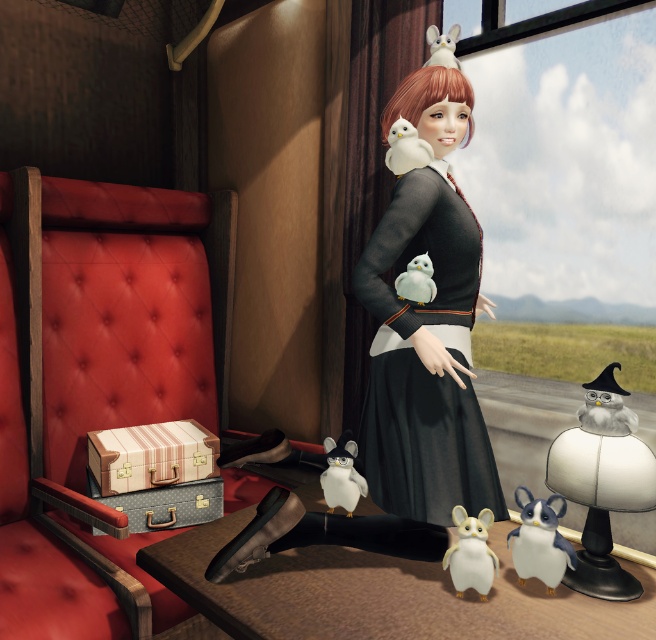
Question: Which point is closer to the camera?

Choices:
 (A) (468, 502)
 (B) (569, 566)
 (C) (256, 577)

Answer: (B)

Question: Which point is farther to the camera?

Choices:
 (A) white plush bird at upper center
 (B) white plush penguin at center

Answer: (B)

Question: Can you confirm if white matte mouse at lower center is positioned to the right of white matte plush toy at center?

Choices:
 (A) no
 (B) yes

Answer: (B)

Question: Is black matte dress at center to the left of white plush bird at upper center from the viewer's perspective?

Choices:
 (A) yes
 (B) no

Answer: (B)

Question: Can you confirm if leather table at lower center is positioned to the left of white plush penguin at center?

Choices:
 (A) no
 (B) yes

Answer: (A)

Question: Which of the following is the farthest from the observer?

Choices:
 (A) black matte dress at center
 (B) white matte plush toy at lower right

Answer: (A)